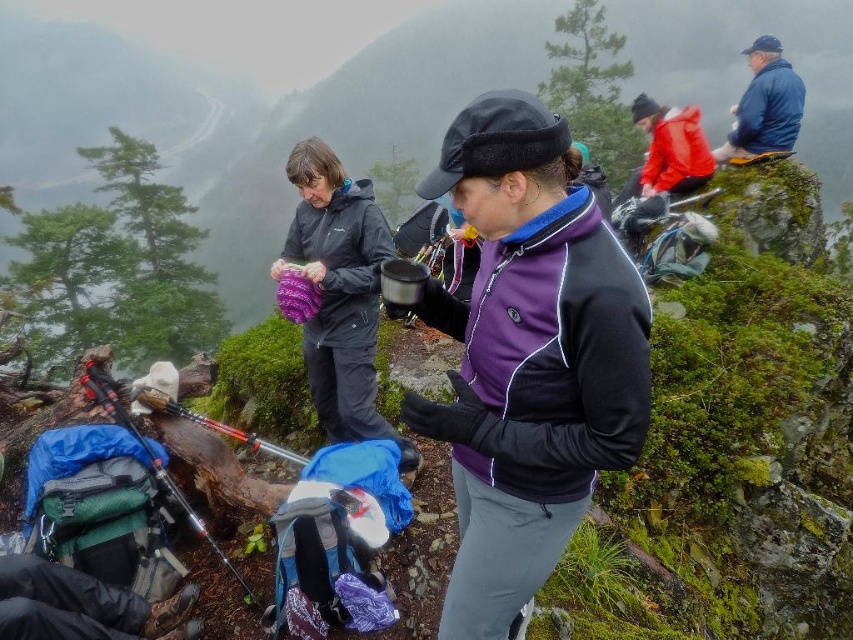
The height and width of the screenshot is (640, 853). Describe the element at coordinates (103, 131) in the screenshot. I see `green leafy tree at upper left` at that location.

Is green leafy tree at upper left to the left of blue fleece jacket at upper right from the viewer's perspective?

Indeed, green leafy tree at upper left is positioned on the left side of blue fleece jacket at upper right.

In order to click on green leafy tree at upper left in this screenshot , I will do `click(103, 131)`.

The image size is (853, 640). What are the coordinates of `green leafy tree at upper left` in the screenshot? It's located at (103, 131).

Between blue fleece jacket at upper right and red matte jacket at upper right, which one appears on the left side from the viewer's perspective?

blue fleece jacket at upper right is more to the left.

Is blue fleece jacket at upper right above red matte jacket at upper right?

No.

Is point (756, 51) positioned after point (640, 125)?

No, (756, 51) is closer to viewer.

Locate an element on the screen. blue fleece jacket at upper right is located at coordinates click(x=764, y=104).

Can you confirm if purple fleece jacket at center is wider than green leafy tree at upper left?

In fact, purple fleece jacket at center might be narrower than green leafy tree at upper left.

Between point (471, 592) and point (80, 177), which one is positioned in front?

Point (471, 592) is more forward.

I want to click on purple fleece jacket at center, so click(x=527, y=356).